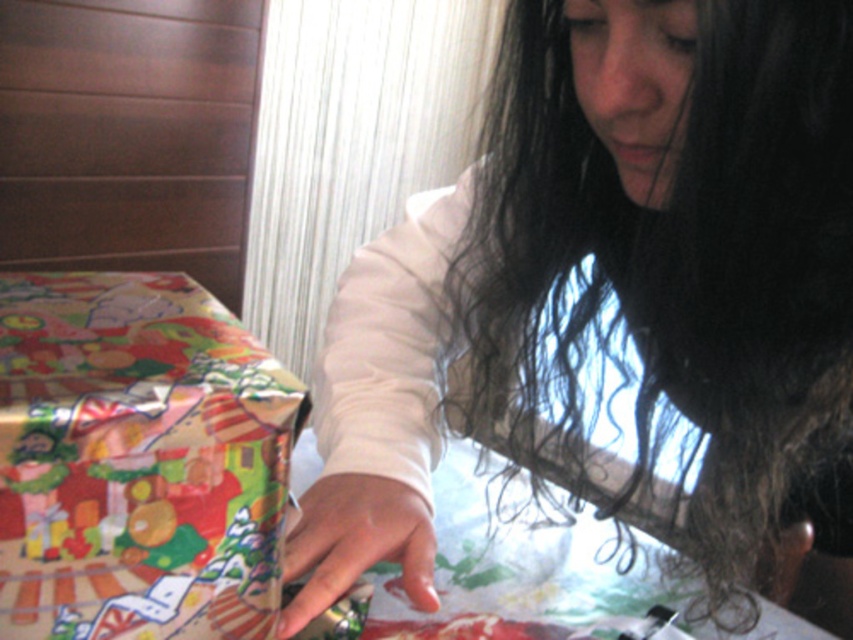
Question: Which object appears closest to the camera in this image?

Choices:
 (A) white matte hand at center
 (B) shiny metallic gift at lower left

Answer: (B)

Question: Is white matte hand at center thinner than shiny metallic gift at lower left?

Choices:
 (A) no
 (B) yes

Answer: (A)

Question: Which of the following is the farthest from the observer?

Choices:
 (A) shiny metallic gift at lower left
 (B) white matte hand at center

Answer: (B)

Question: Can you confirm if white matte hand at center is wider than shiny metallic gift at lower left?

Choices:
 (A) no
 (B) yes

Answer: (B)

Question: Is white matte hand at center smaller than shiny metallic gift at lower left?

Choices:
 (A) no
 (B) yes

Answer: (A)